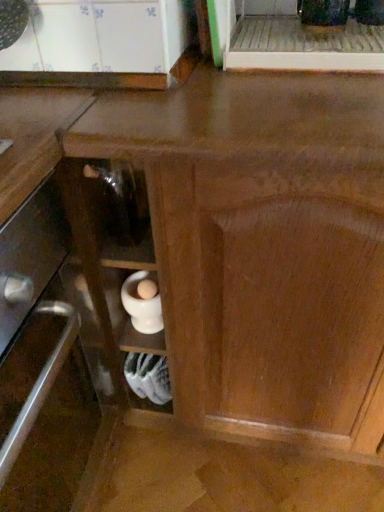
Question: Is white matte mortar at lower center surrounded by white glossy mortar at lower center?

Choices:
 (A) yes
 (B) no

Answer: (B)

Question: Does white glossy mortar at lower center have a smaller size compared to white matte mortar at lower center?

Choices:
 (A) yes
 (B) no

Answer: (A)

Question: Could you tell me if white glossy mortar at lower center is facing white matte mortar at lower center?

Choices:
 (A) no
 (B) yes

Answer: (A)

Question: Is white glossy mortar at lower center completely or partially outside of white matte mortar at lower center?

Choices:
 (A) no
 (B) yes

Answer: (B)

Question: Does white glossy mortar at lower center have a lesser height compared to white matte mortar at lower center?

Choices:
 (A) no
 (B) yes

Answer: (B)

Question: Is white glossy mortar at lower center positioned behind white matte mortar at lower center?

Choices:
 (A) no
 (B) yes

Answer: (A)

Question: Is white matte mortar at lower center turned away from white glossy mortar at lower center?

Choices:
 (A) no
 (B) yes

Answer: (A)

Question: Is white matte mortar at lower center further to camera compared to white glossy mortar at lower center?

Choices:
 (A) no
 (B) yes

Answer: (B)

Question: Is white matte mortar at lower center in contact with white glossy mortar at lower center?

Choices:
 (A) yes
 (B) no

Answer: (B)

Question: Is white matte mortar at lower center wider than white glossy mortar at lower center?

Choices:
 (A) no
 (B) yes

Answer: (B)

Question: From a real-world perspective, is white matte mortar at lower center over white glossy mortar at lower center?

Choices:
 (A) yes
 (B) no

Answer: (B)

Question: From the image's perspective, is white matte mortar at lower center over white glossy mortar at lower center?

Choices:
 (A) no
 (B) yes

Answer: (A)

Question: Is point (170, 392) positioned closer to the camera than point (147, 300)?

Choices:
 (A) closer
 (B) farther

Answer: (B)